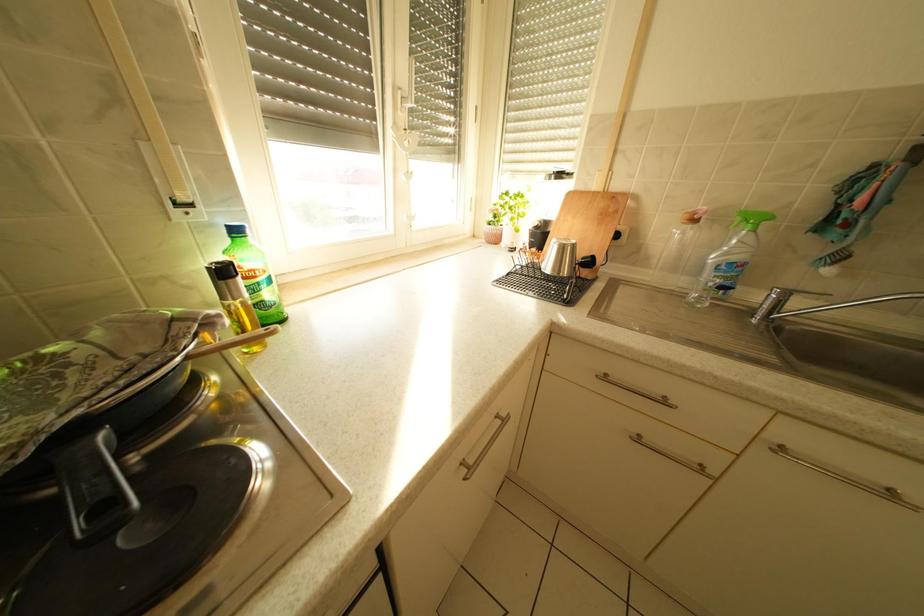
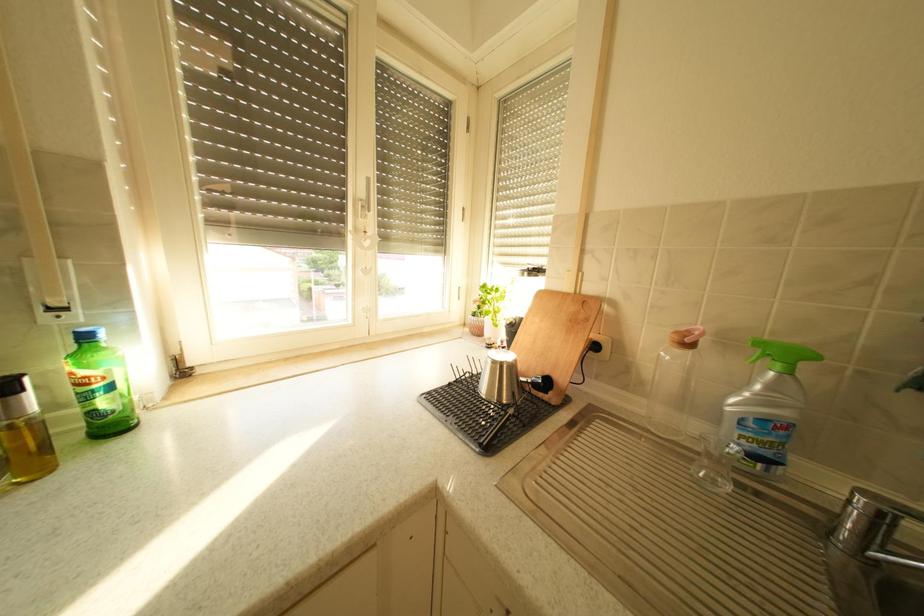
The images are taken continuously from a first-person perspective. In which direction are you moving?

The cameraman walked toward right, forward.